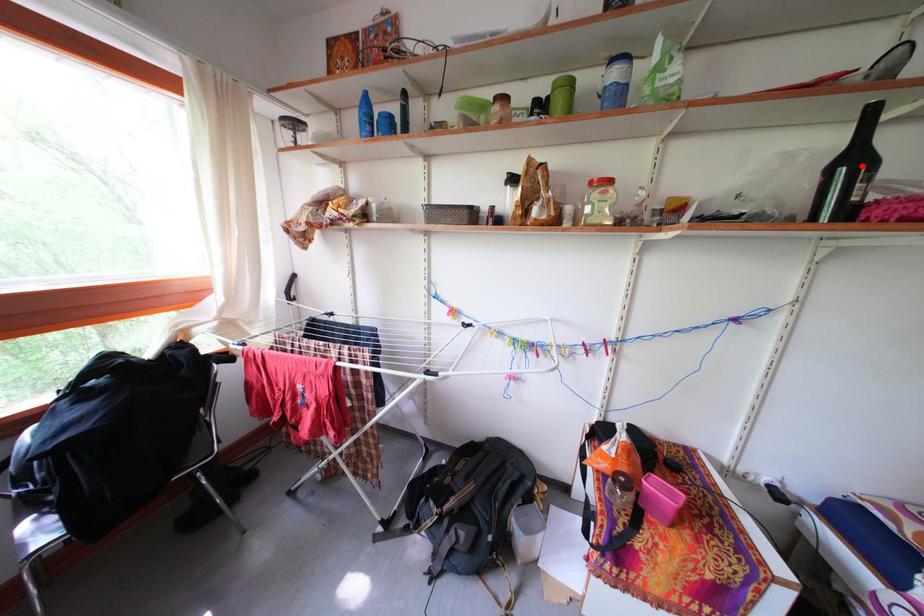
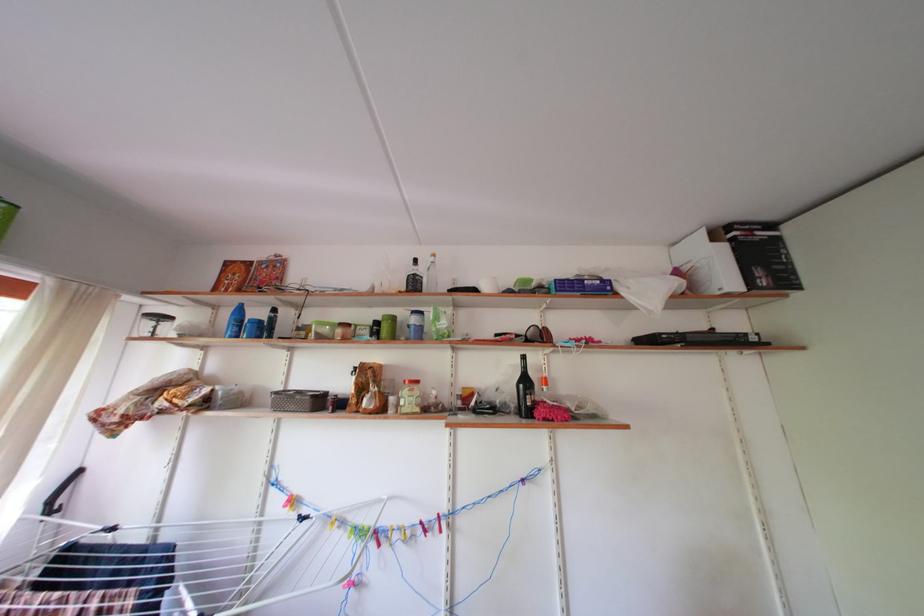
Where in the second image is the point corresponding to the highlighted location from the first image?

(533, 387)